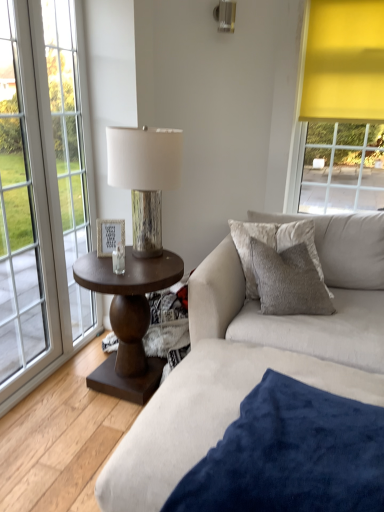
Identify the location of vacant area in front of dark wood side table at center. The image size is (384, 512). (71, 447).